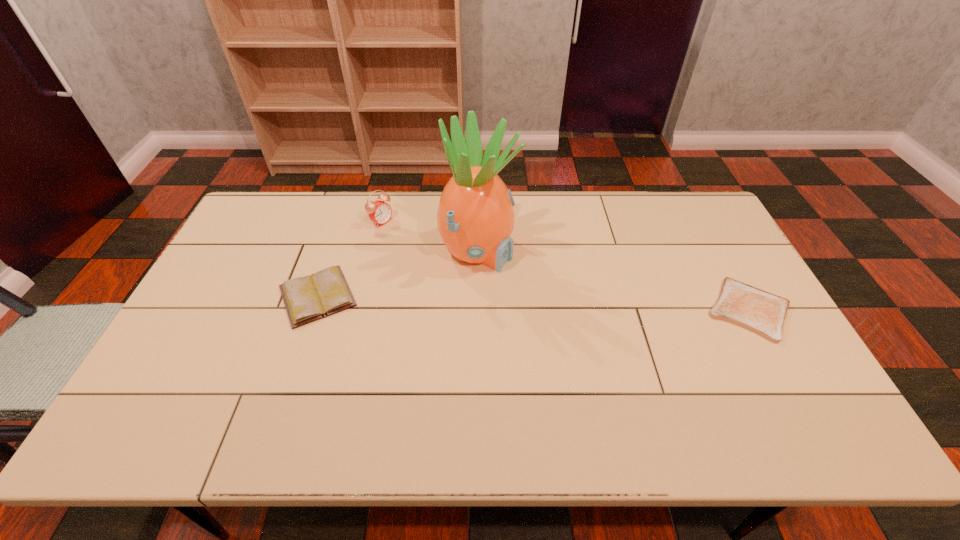
This screenshot has width=960, height=540. In order to click on vacant space on the desktop that is between the second shortest object and the shortest object and is positioned on the clock face of the second tallest object in this screenshot , I will do `click(513, 302)`.

Identify the location of free spot on the desktop that is between the third tallest object and the shortest object and is positioned at the entrance of the pineapple. This screenshot has height=540, width=960. (593, 305).